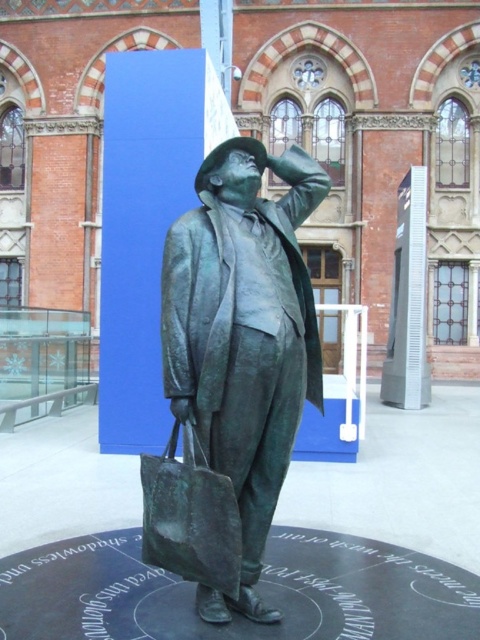
Between bronze statue at center and green patina bag at center, which one appears on the left side from the viewer's perspective?

green patina bag at center is more to the left.

Is bronze statue at center positioned behind green patina bag at center?

That is True.

Where is `bronze statue at center`? The width and height of the screenshot is (480, 640). bronze statue at center is located at coordinates (242, 337).